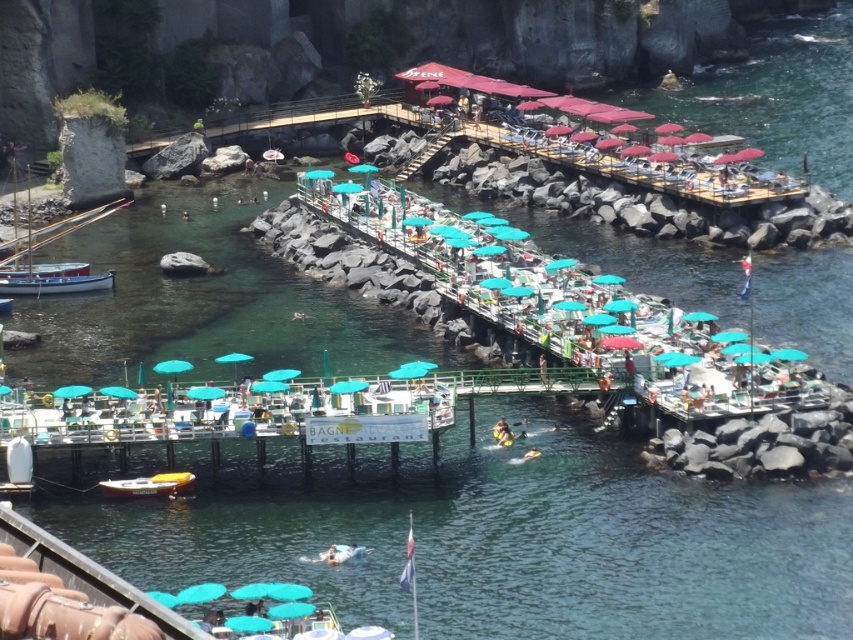
You are standing at the camera position and want to walk towards the green plastic umbrellas at center. How many steps would you need to take to reach them if each step is approximately 2.5 feet?

The distance between the green plastic umbrellas at center and the camera is 171.82 feet. Dividing this by the step length of 2.5 feet per step gives approximately 68.728 steps. Since you can only take whole steps, you would need to take 69 steps to reach the green plastic umbrellas at center.

You are a painter setting up your easel to capture the vibrant colors of the scene. You want to ensure your canvas can fit both the green plastic umbrellas at center and the teal fabric umbrella at center. Given that your canvas is 1.5 meters wide, will both objects fit side by side horizontally?

The green plastic umbrellas at center is bigger than teal fabric umbrella at center. However, without specific measurements of their widths, it is impossible to determine if they will fit on a 1.5 meter canvas. Consider using a larger canvas or adjusting the composition.